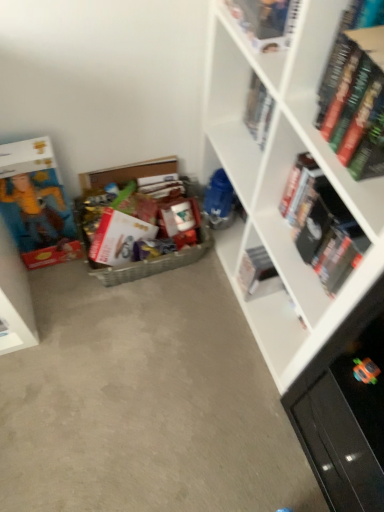
Where is `unoccupied area in front of matte cardboard box at left`? This screenshot has width=384, height=512. unoccupied area in front of matte cardboard box at left is located at coordinates (62, 289).